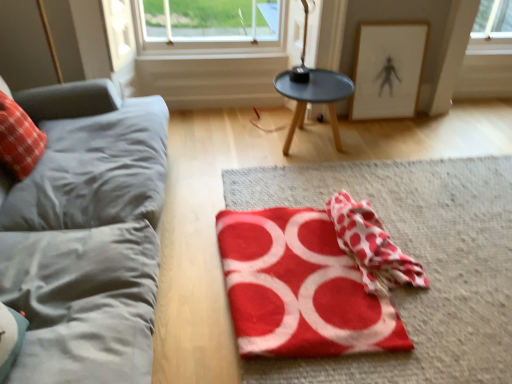
Question: In the image, is red fabric at center on the left side or the right side of red polka dot fabric at center?

Choices:
 (A) left
 (B) right

Answer: (B)

Question: Based on their sizes in the image, would you say red fabric at center is bigger or smaller than red polka dot fabric at center?

Choices:
 (A) big
 (B) small

Answer: (A)

Question: Based on their relative distances, which object is nearer to the red plaid throw pillow at left?

Choices:
 (A) white paper picture frame at upper right
 (B) red felt yoga mat at center
 (C) gray fabric couch at left
 (D) black matte table at center
 (E) red fabric at center

Answer: (C)

Question: Estimate the real-world distances between objects in this image. Which object is farther from the red fabric at center?

Choices:
 (A) red plaid throw pillow at left
 (B) red felt yoga mat at center
 (C) white paper picture frame at upper right
 (D) black matte table at center
 (E) gray fabric couch at left

Answer: (A)